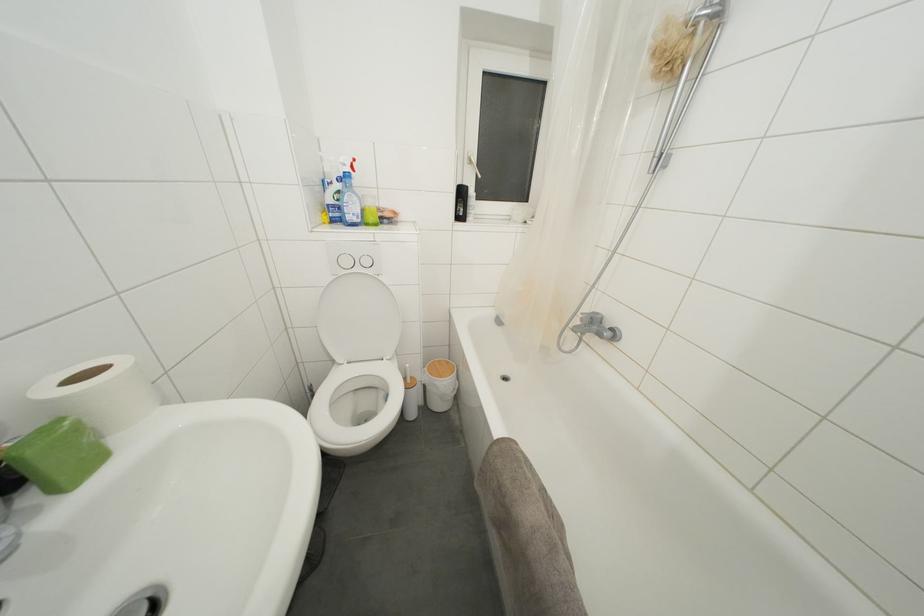
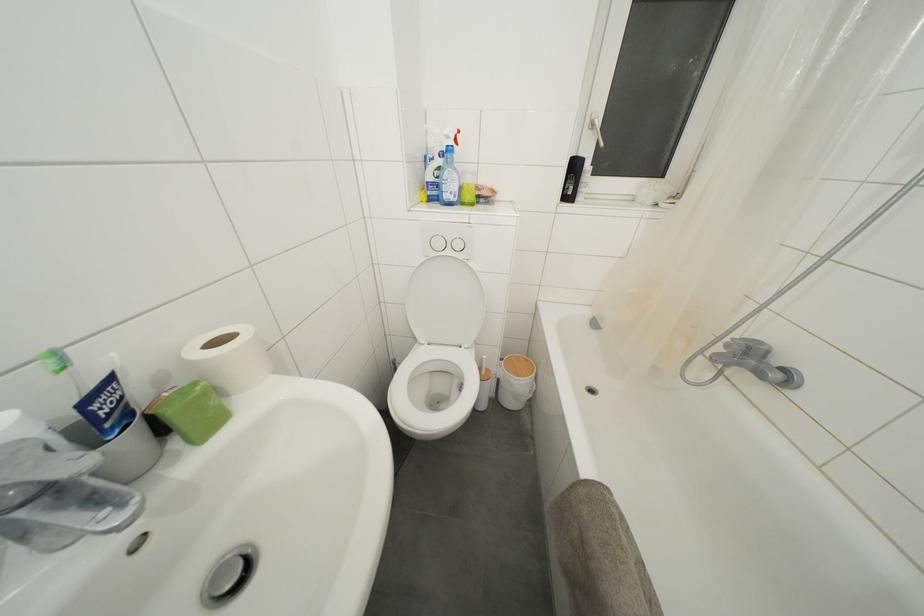
Locate, in the second image, the point that corresponds to (x=444, y=366) in the first image.

(521, 362)